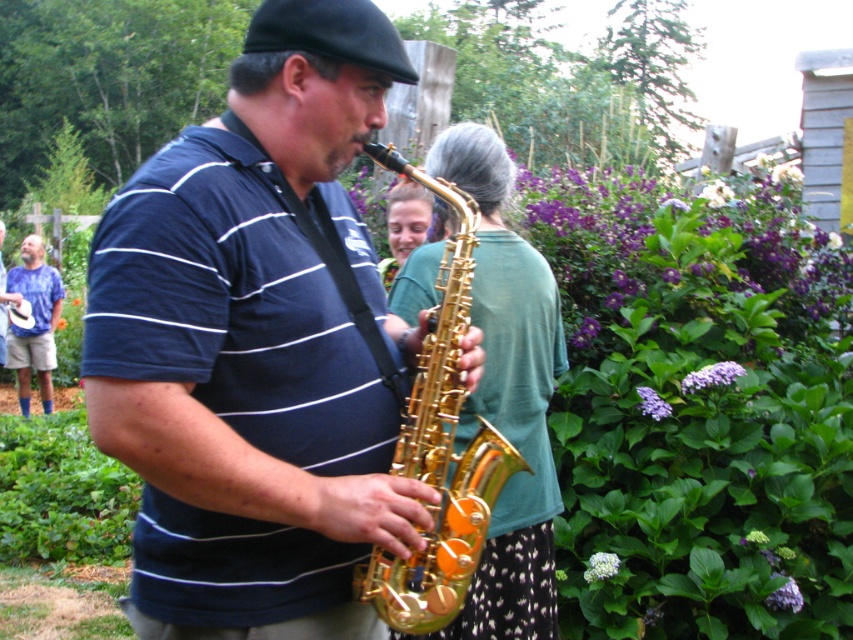
Measure the distance between matte green shirt at center and blue tie-dye shirt at left.

matte green shirt at center is 8.63 meters away from blue tie-dye shirt at left.

Who is positioned more to the left, matte green shirt at center or blue tie-dye shirt at left?

From the viewer's perspective, blue tie-dye shirt at left appears more on the left side.

Find the location of `matte green shirt at center`. matte green shirt at center is located at coordinates (508, 397).

What are the coordinates of `matte green shirt at center` in the screenshot? It's located at click(x=508, y=397).

How distant is shiny gold saxophone at center from blue tie-dye shirt at left?

A distance of 31.76 feet exists between shiny gold saxophone at center and blue tie-dye shirt at left.

Consider the image. Can you confirm if shiny gold saxophone at center is smaller than blue tie-dye shirt at left?

Correct, shiny gold saxophone at center occupies less space than blue tie-dye shirt at left.

Locate an element on the screen. shiny gold saxophone at center is located at coordinates tap(257, 346).

Can you confirm if shiny gold saxophone at center is positioned to the right of matte green shirt at center?

Incorrect, shiny gold saxophone at center is not on the right side of matte green shirt at center.

Between shiny gold saxophone at center and matte green shirt at center, which one has less height?

With less height is shiny gold saxophone at center.

Does point (352, 90) come farther from viewer compared to point (496, 189)?

That is False.

At what (x,y) coordinates should I click in order to perform the action: click on shiny gold saxophone at center. Please return your answer as a coordinate pair (x, y). Image resolution: width=853 pixels, height=640 pixels. Looking at the image, I should click on (257, 346).